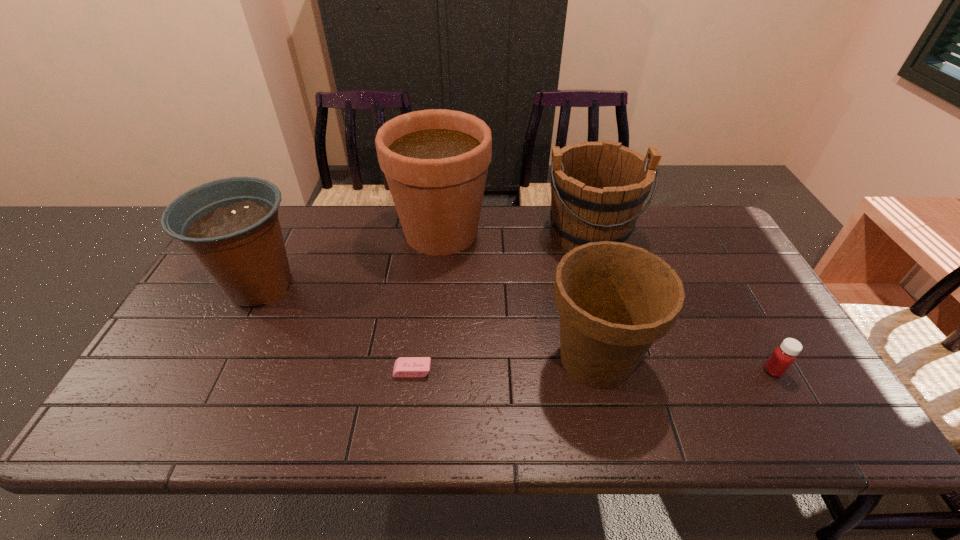
Find the location of a particular element. the tallest flowerpot is located at coordinates (605, 387).

Locate an element on the screen. Image resolution: width=960 pixels, height=540 pixels. wine bucket is located at coordinates (509, 242).

The width and height of the screenshot is (960, 540). In order to click on the leftmost object in this screenshot , I will do `click(681, 226)`.

In order to click on the rightmost flowerpot in this screenshot , I will do `click(246, 330)`.

The width and height of the screenshot is (960, 540). Find the location of `eraser`. eraser is located at coordinates (285, 131).

The image size is (960, 540). What are the coordinates of `vacant space situated 0.280m on the left of the tallest flowerpot` in the screenshot? It's located at (307, 232).

The image size is (960, 540). Identify the location of vacant space located 0.340m on the side of the wine bucket with the handle for carrying. (624, 354).

You are a GUI agent. You are given a task and a screenshot of the screen. Output one action in this format:
    pyautogui.click(x=<x>, y=<y>)
    Task: Click on the free location located 0.190m on the back of the leftmost object
    The image size is (960, 540).
    Given the screenshot: What is the action you would take?
    pyautogui.click(x=295, y=218)

At what (x,y) coordinates should I click in order to perform the action: click on vacant area located 0.320m on the left of the rightmost flowerpot. Please return your answer as a coordinate pair (x, y). Looking at the image, I should click on (414, 359).

I want to click on free region located 0.310m on the left of the shortest object, so (x=265, y=371).